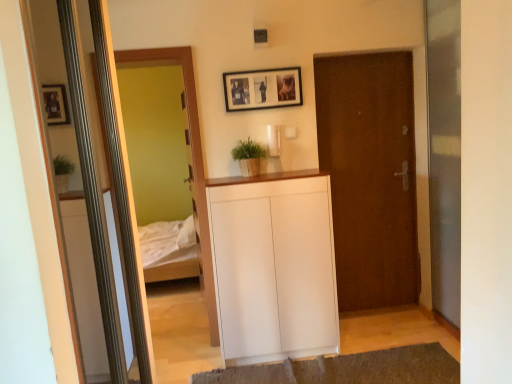
Where is `vacant location below wooden framed mirror at left (from a real-world perspective)`? vacant location below wooden framed mirror at left (from a real-world perspective) is located at coordinates (181, 339).